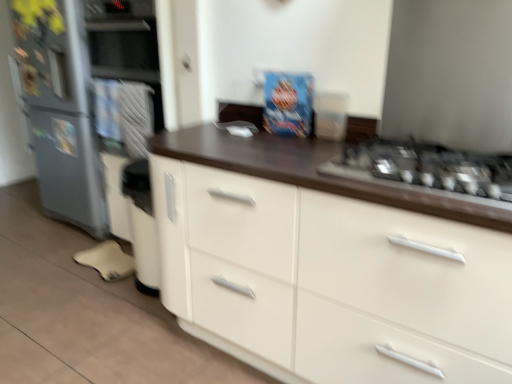
Question: Does metallic silver gas stove at right have a larger size compared to metallic gray refrigerator at left?

Choices:
 (A) yes
 (B) no

Answer: (B)

Question: Can you confirm if metallic silver gas stove at right is shorter than metallic gray refrigerator at left?

Choices:
 (A) no
 (B) yes

Answer: (B)

Question: Is metallic silver gas stove at right further to the viewer compared to metallic gray refrigerator at left?

Choices:
 (A) yes
 (B) no

Answer: (B)

Question: Can you confirm if metallic silver gas stove at right is wider than metallic gray refrigerator at left?

Choices:
 (A) yes
 (B) no

Answer: (A)

Question: Is metallic silver gas stove at right positioned far away from metallic gray refrigerator at left?

Choices:
 (A) yes
 (B) no

Answer: (A)

Question: Is metallic gray refrigerator at left taller or shorter than metallic silver gas stove at right?

Choices:
 (A) tall
 (B) short

Answer: (A)

Question: In terms of size, does metallic gray refrigerator at left appear bigger or smaller than metallic silver gas stove at right?

Choices:
 (A) small
 (B) big

Answer: (B)

Question: From a real-world perspective, relative to metallic silver gas stove at right, is metallic gray refrigerator at left vertically above or below?

Choices:
 (A) above
 (B) below

Answer: (B)

Question: In the image, is metallic gray refrigerator at left on the left side or the right side of metallic silver gas stove at right?

Choices:
 (A) right
 (B) left

Answer: (B)

Question: Is point (49, 122) closer or farther from the camera than point (196, 180)?

Choices:
 (A) farther
 (B) closer

Answer: (A)

Question: Relative to white glossy cabinet at center, is metallic gray refrigerator at left in front or behind?

Choices:
 (A) front
 (B) behind

Answer: (B)

Question: Do you think metallic gray refrigerator at left is within white glossy cabinet at center, or outside of it?

Choices:
 (A) inside
 (B) outside

Answer: (B)

Question: From a real-world perspective, is metallic gray refrigerator at left positioned above or below white glossy cabinet at center?

Choices:
 (A) above
 (B) below

Answer: (A)

Question: Looking at their shapes, would you say metallic silver gas stove at right is wider or thinner than metallic gray refrigerator at left?

Choices:
 (A) thin
 (B) wide

Answer: (B)

Question: In the image, is metallic silver gas stove at right on the left side or the right side of metallic gray refrigerator at left?

Choices:
 (A) left
 (B) right

Answer: (B)